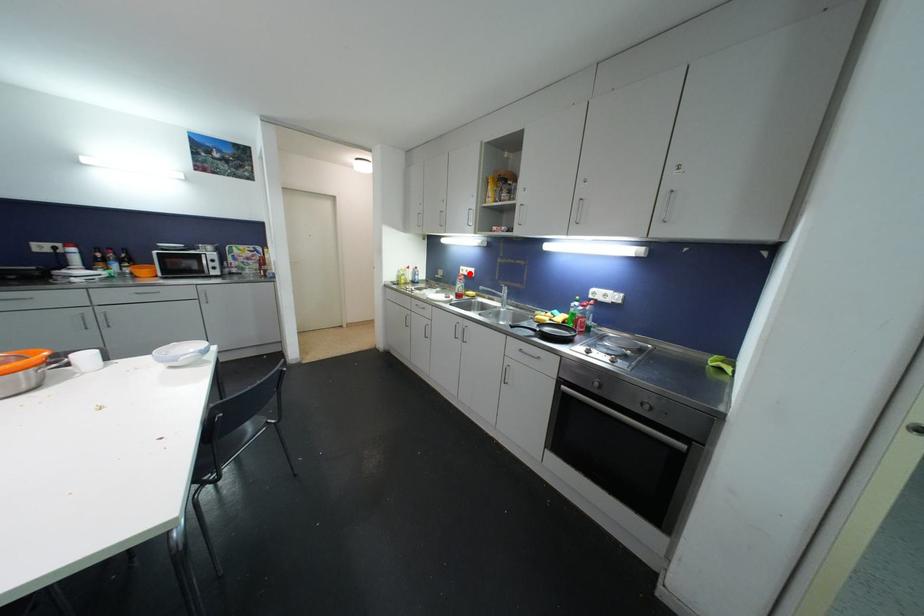
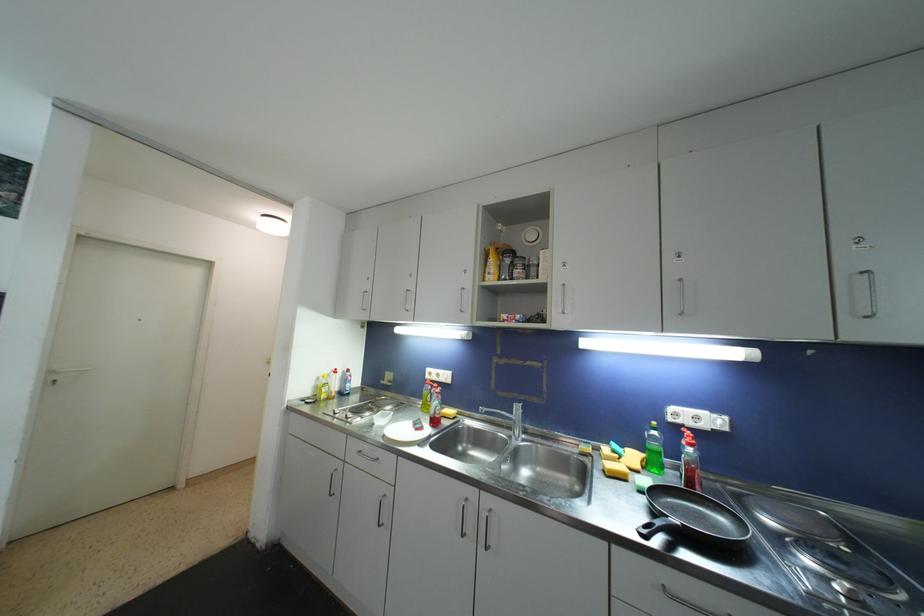
Locate, in the second image, the point that corresponds to the highlighted location in the first image.

(441, 378)